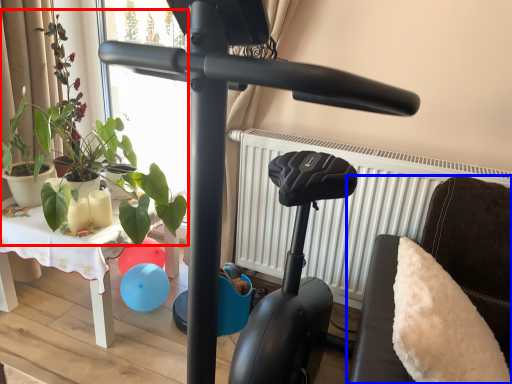
Question: Among these objects, which one is farthest to the camera, plant (highlighted by a red box) or furniture (highlighted by a blue box)?

Choices:
 (A) plant
 (B) furniture

Answer: (A)